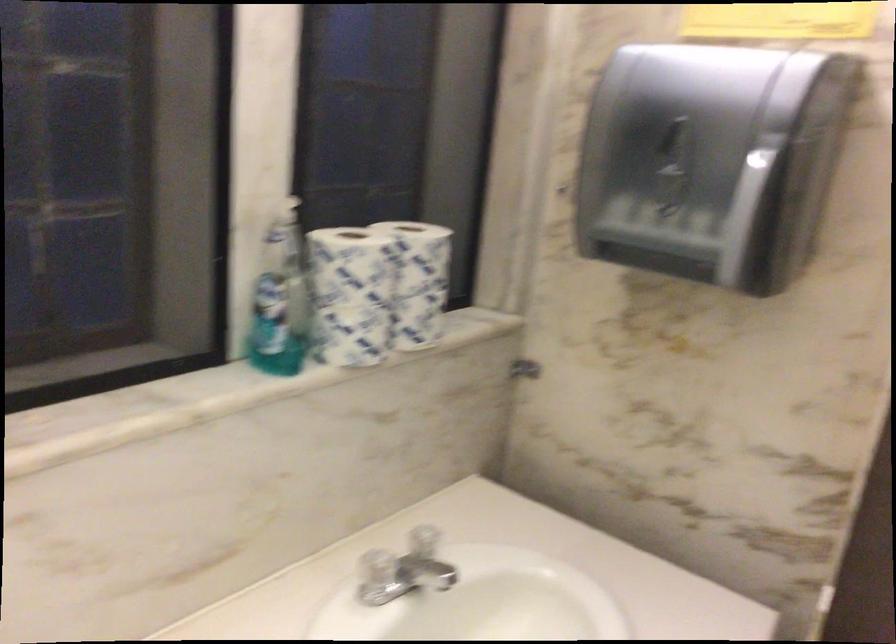
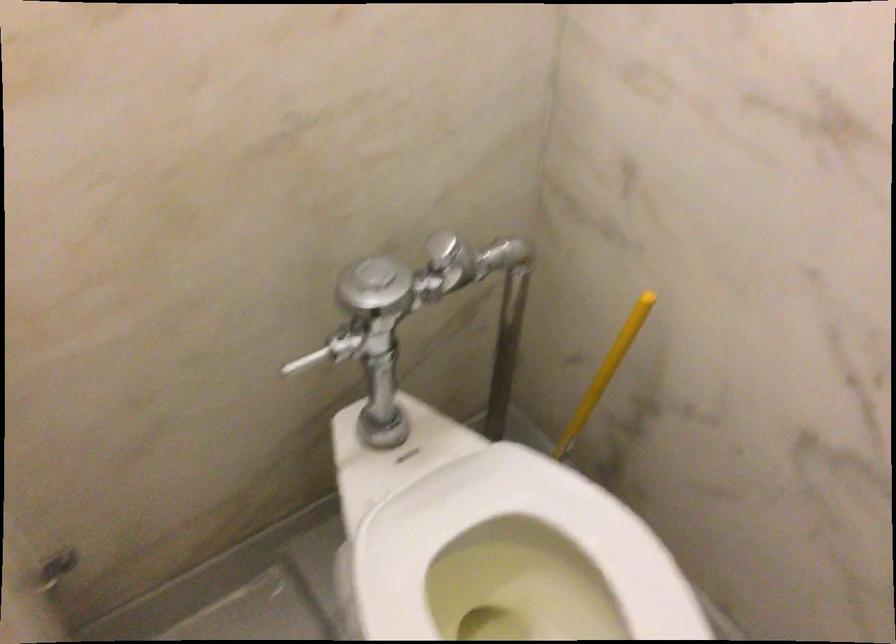
The images are taken continuously from a first-person perspective. In which direction are you moving?

The cameraman moved toward right, forward.